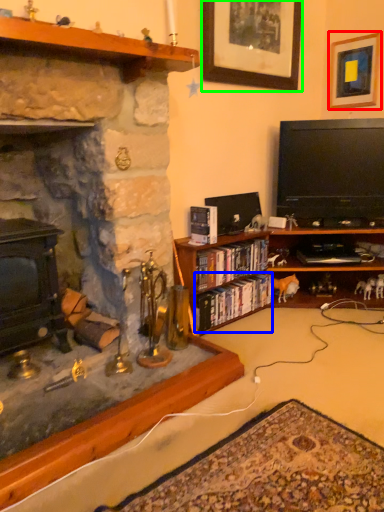
Question: Based on their relative distances, which object is nearer to picture frame (highlighted by a red box)? Choose from book (highlighted by a blue box) and picture frame (highlighted by a green box).

Choices:
 (A) book
 (B) picture frame

Answer: (B)